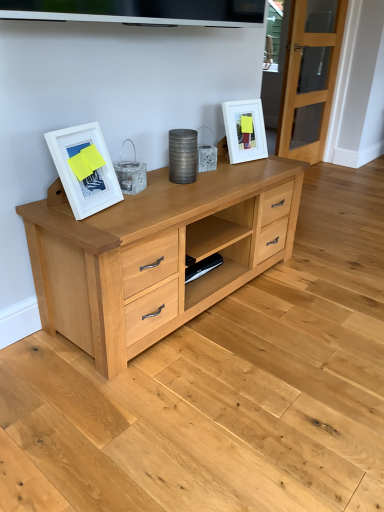
Question: Considering their positions, is white matte picture frame at upper right, which appears as the 1th picture frame when viewed from the top, located in front of or behind white matte picture frame at left, placed as the 1th picture frame when sorted from front to back?

Choices:
 (A) front
 (B) behind

Answer: (B)

Question: Considering the positions of white matte picture frame at upper right, which is the 2th picture frame in bottom-to-top order, and white matte picture frame at left, placed as the 1th picture frame when sorted from front to back, in the image, is white matte picture frame at upper right, which is the 2th picture frame in bottom-to-top order, bigger or smaller than white matte picture frame at left, placed as the 1th picture frame when sorted from front to back,?

Choices:
 (A) small
 (B) big

Answer: (B)

Question: Which of these objects is positioned farthest from the clear glass door at right?

Choices:
 (A) white matte picture frame at left, placed as the 1th picture frame when sorted from front to back
 (B) white matte picture frame at upper right, acting as the 2th picture frame starting from the left

Answer: (A)

Question: Which object is the farthest from the white matte picture frame at left, placed as the 1th picture frame when sorted from front to back?

Choices:
 (A) clear glass door at right
 (B) white matte picture frame at upper right, which appears as the first picture frame when viewed from the right

Answer: (A)